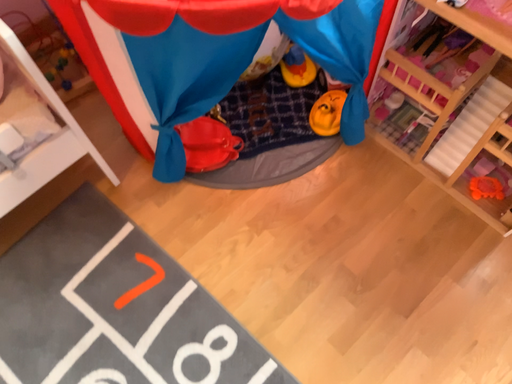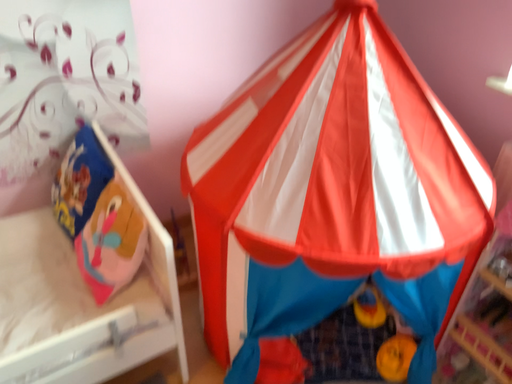
Question: How did the camera likely rotate when shooting the video?

Choices:
 (A) rotated upward
 (B) rotated downward

Answer: (A)